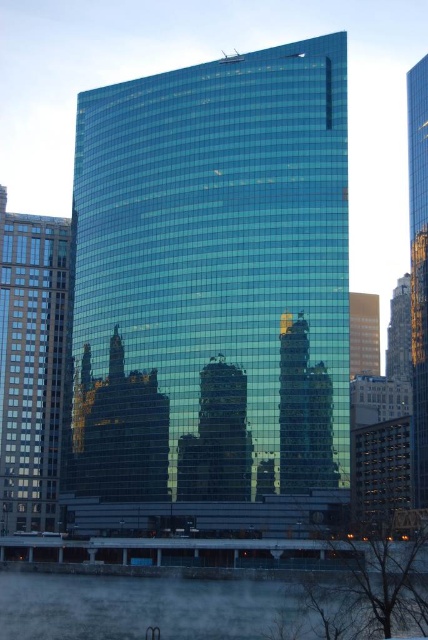
Is point (35, 369) positioned before point (425, 340)?

No, (35, 369) is behind (425, 340).

From the picture: Does matte glass skyscraper at left have a lesser width compared to reflective glass skyscraper at right?

Indeed, matte glass skyscraper at left has a lesser width compared to reflective glass skyscraper at right.

This screenshot has width=428, height=640. What are the coordinates of `matte glass skyscraper at left` in the screenshot? It's located at (32, 365).

The width and height of the screenshot is (428, 640). In order to click on matte glass skyscraper at left in this screenshot , I will do `click(32, 365)`.

Does shiny glass tower at center have a greater height compared to shiny glass skyscraper at center?

Correct, shiny glass tower at center is much taller as shiny glass skyscraper at center.

Between point (113, 362) and point (365, 307), which one is positioned behind?

Point (365, 307)

Locate an element on the screen. The width and height of the screenshot is (428, 640). shiny glass tower at center is located at coordinates (213, 280).

The height and width of the screenshot is (640, 428). Find the location of `shiny glass tower at center`. shiny glass tower at center is located at coordinates (x=213, y=280).

Measure the distance between reflective glass skyscraper at right and shiny glass skyscraper at right.

reflective glass skyscraper at right and shiny glass skyscraper at right are 21.36 meters apart.

Who is shorter, reflective glass skyscraper at right or shiny glass skyscraper at right?

With less height is shiny glass skyscraper at right.

Between point (422, 483) and point (391, 317), which one is positioned in front?

Point (422, 483)

Where is `reflective glass skyscraper at right`? The image size is (428, 640). reflective glass skyscraper at right is located at coordinates (419, 268).